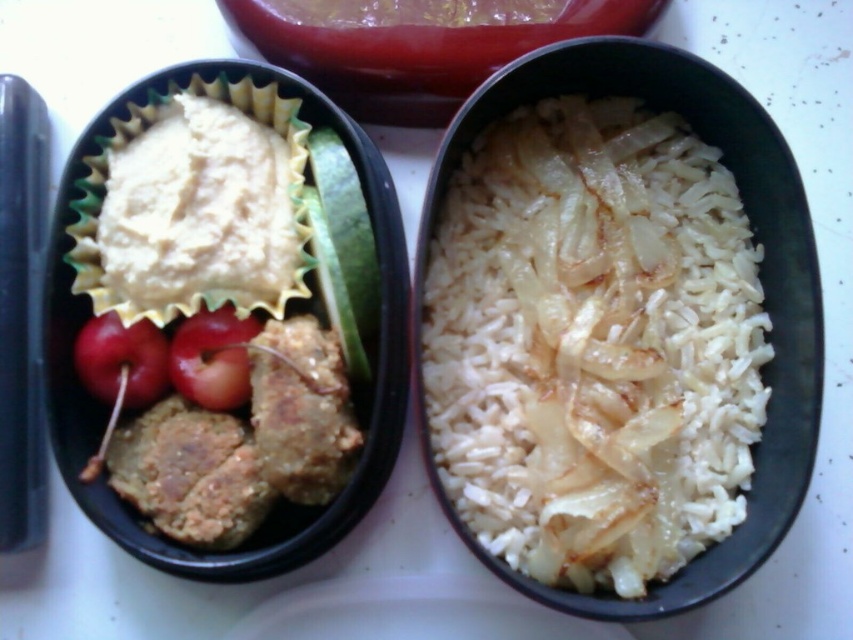
You are a food delivery person who needs to locate the white matte rice at right in the image. What are the coordinates where you should look?

The white matte rice at right is located at coordinates point (x=593, y=342).

Consider the image. You are a food critic standing 5 feet away from the meal. Can you see the red shiny cherry at left clearly from your position?

The red shiny cherry at left is 3.86 feet away from the camera, so yes, you can see it clearly from 5 feet away since it is within a reasonable viewing distance.